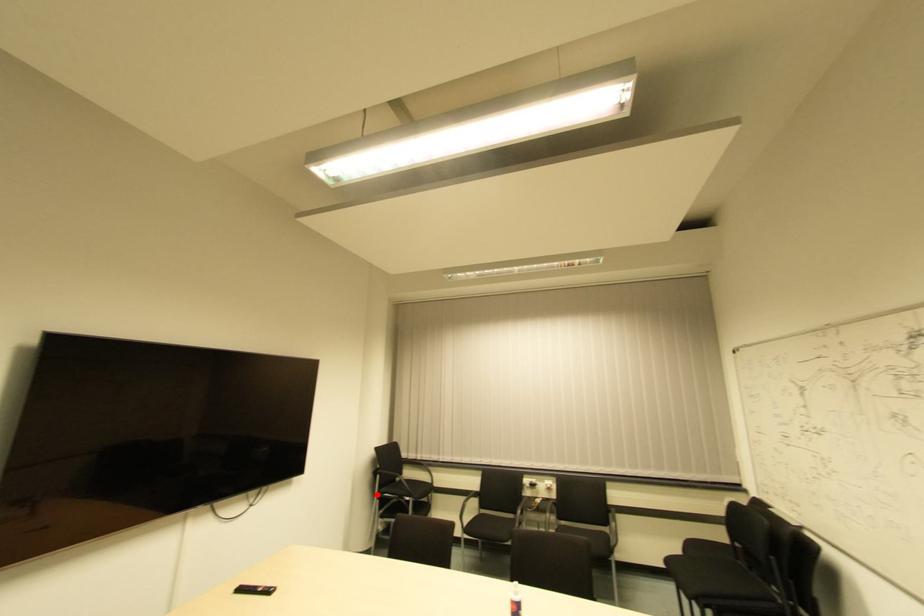
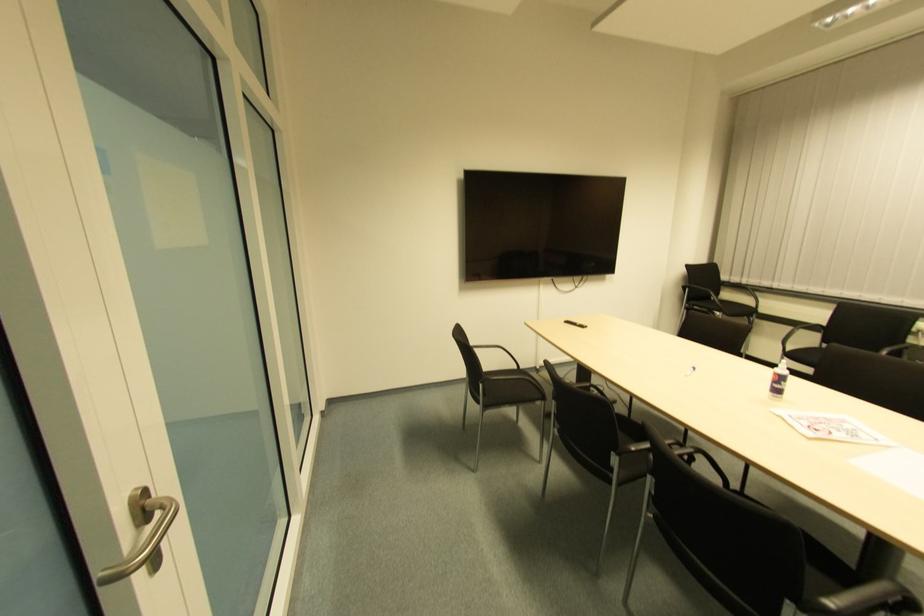
Question: I am providing you with two images of the same scene from different viewpoints. A red point is shown in image1. For the corresponding object point in image2, is it positioned nearer or farther from the camera?

Choices:
 (A) Nearer
 (B) Farther

Answer: (A)